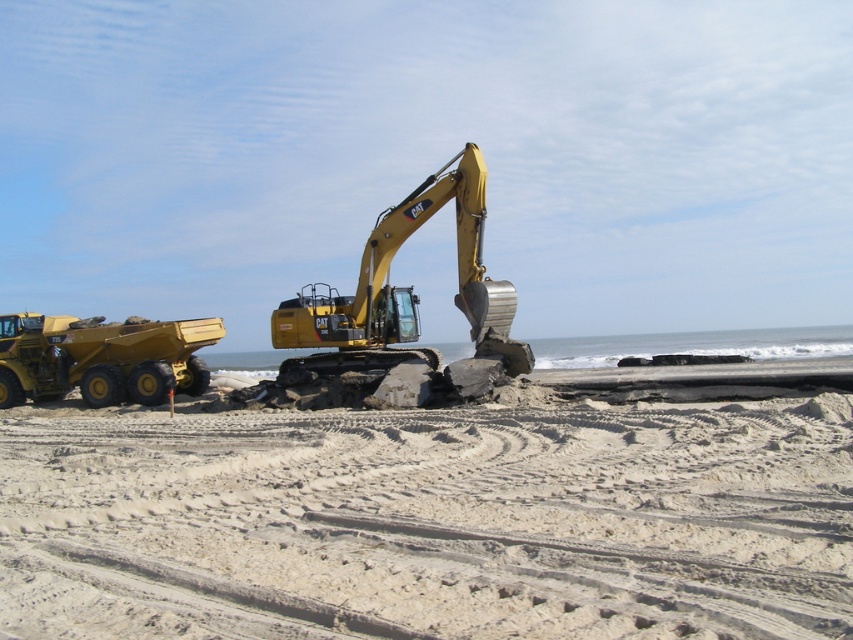
You are a construction worker who needs to move heavy equipment from the matte yellow dump truck at left to the white sandy beach at center. Which object is lower to the ground so that you can easily transfer the equipment without needing a ramp?

The white sandy beach at center is positioned under the matte yellow dump truck at left, so the beach is lower to the ground. You can transfer the equipment directly from the dump truck to the beach without needing a ramp.

You are a construction worker operating a 2.5 meter wide forklift. You need to move a heavy load from the yellow metallic excavator at center to the matte yellow dump truck at left. Can your forklift safely navigate the path between them without any obstructions?

The distance between the yellow metallic excavator at center and the matte yellow dump truck at left is 6.87 meters. Since the forklift is 2.5 meters wide, there is sufficient space for it to navigate the path between them safely as long as there are no other obstructions mentioned in the scene.